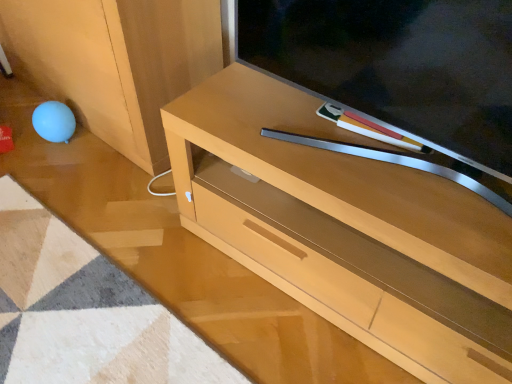
Find the location of `free region under matte wood television at center (from a real-world perspective)`. free region under matte wood television at center (from a real-world perspective) is located at coordinates (362, 155).